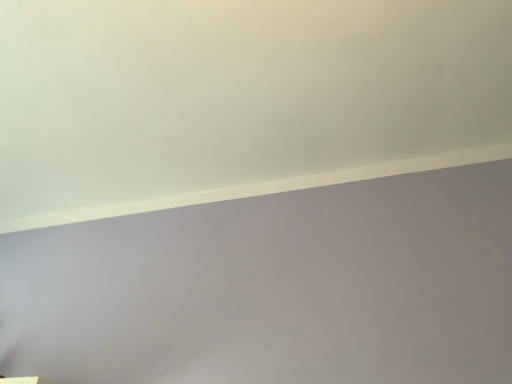
Describe the element at coordinates (239, 99) in the screenshot. This screenshot has width=512, height=384. I see `white matte whiteboard at upper center` at that location.

I want to click on white matte whiteboard at upper center, so click(239, 99).

At what (x,y) coordinates should I click in order to perform the action: click on white matte whiteboard at upper center. Please return your answer as a coordinate pair (x, y). This screenshot has width=512, height=384. Looking at the image, I should click on (239, 99).